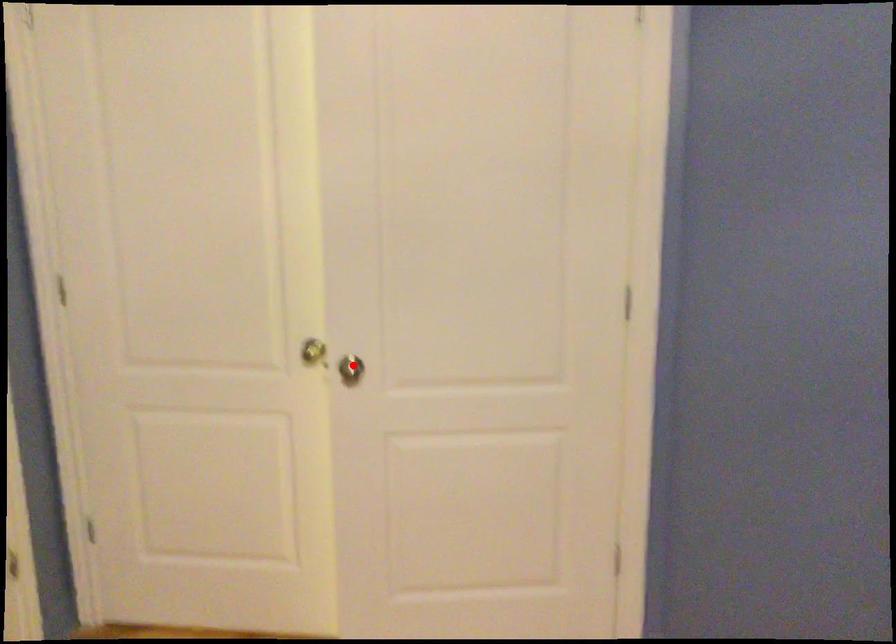
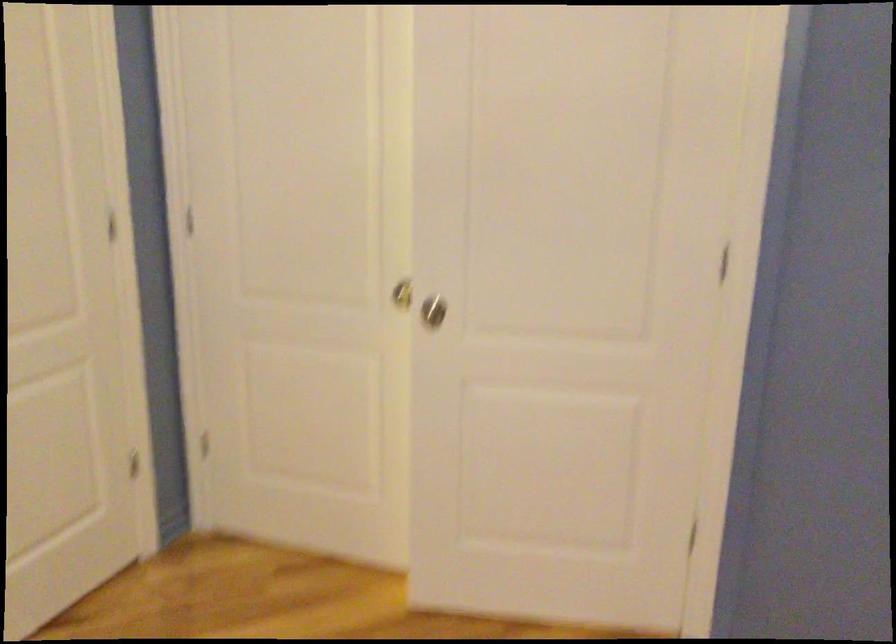
Locate, in the second image, the point that corresponds to the highlighted location in the first image.

(433, 310)